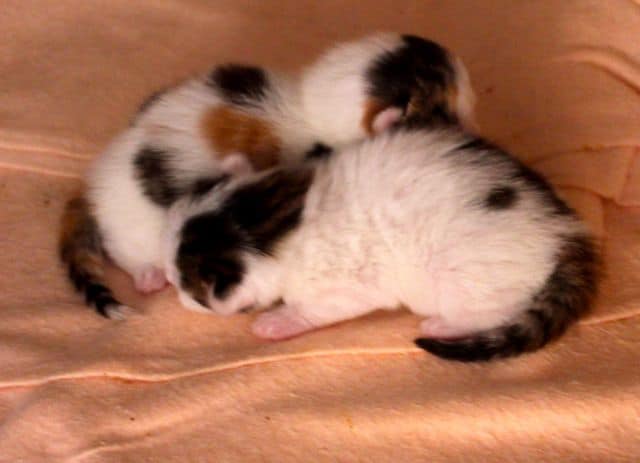
You are a GUI agent. You are given a task and a screenshot of the screen. Output one action in this format:
    pyautogui.click(x=<x>, y=<y>)
    Task: Click on the white fur
    The height and width of the screenshot is (463, 640).
    Given the screenshot: What is the action you would take?
    pyautogui.click(x=408, y=206)